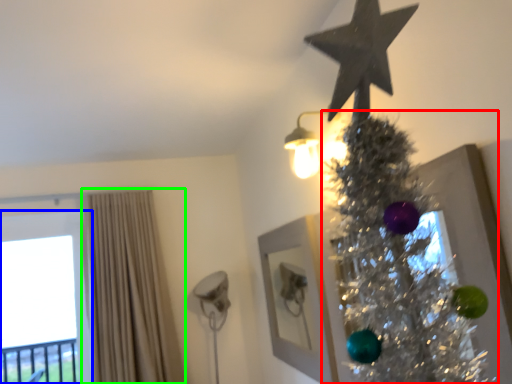
Question: Considering the real-world distances, which object is farthest from christmas tree (highlighted by a red box)? window (highlighted by a blue box) or curtain (highlighted by a green box)?

Choices:
 (A) window
 (B) curtain

Answer: (A)